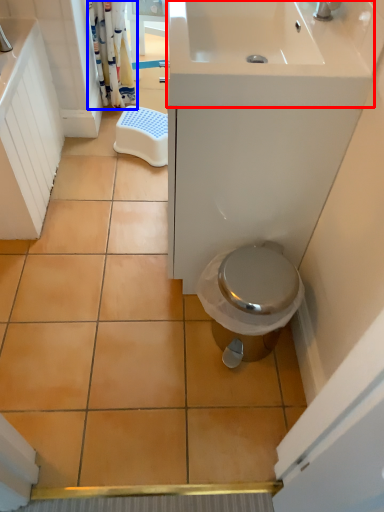
Question: Which point is closer to the camera, sink (highlighted by a red box) or shower curtain (highlighted by a blue box)?

Choices:
 (A) sink
 (B) shower curtain

Answer: (A)